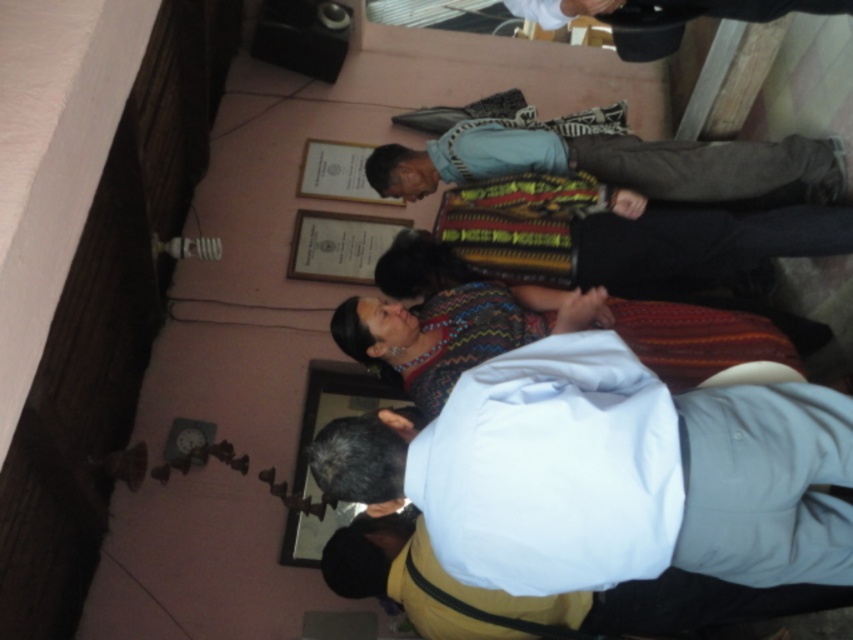
Question: Is matte paper picture frame at center above matte gold frame at upper center?

Choices:
 (A) no
 (B) yes

Answer: (A)

Question: Based on their relative distances, which object is farther from the blue cotton shirt at center?

Choices:
 (A) matte gold frame at upper center
 (B) wooden frame at lower center

Answer: (B)

Question: Which of the following is the farthest from the observer?

Choices:
 (A) (364, 189)
 (B) (318, 422)
 (C) (387, 168)
 (D) (369, 218)

Answer: (A)

Question: Considering the relative positions of wooden frame at lower center and matte paper picture frame at center in the image provided, where is wooden frame at lower center located with respect to matte paper picture frame at center?

Choices:
 (A) above
 (B) below

Answer: (B)

Question: Which of these objects is positioned closest to the wooden frame at lower center?

Choices:
 (A) matte gold frame at upper center
 (B) blue cotton shirt at center

Answer: (A)

Question: Can you confirm if wooden frame at lower center is positioned above matte paper picture frame at center?

Choices:
 (A) yes
 (B) no

Answer: (B)